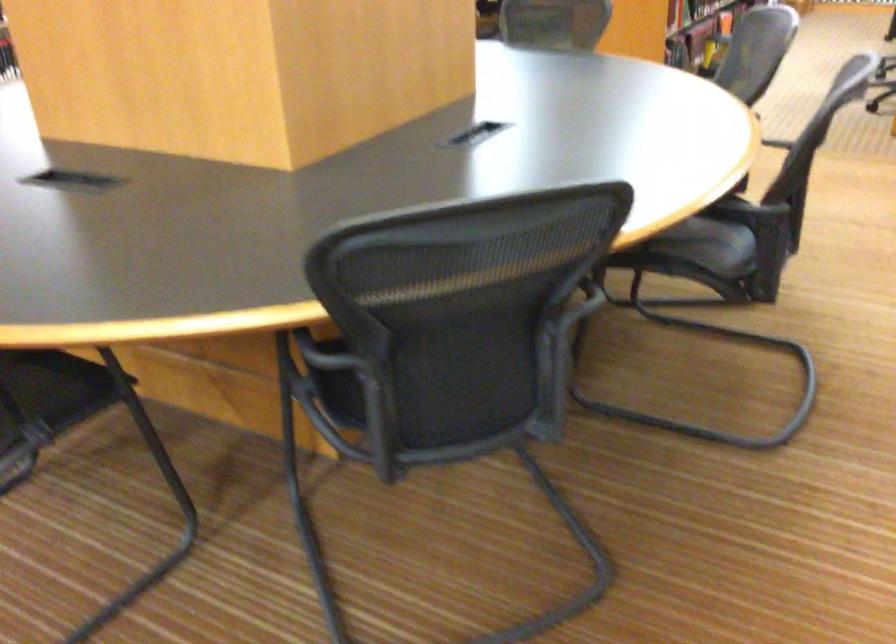
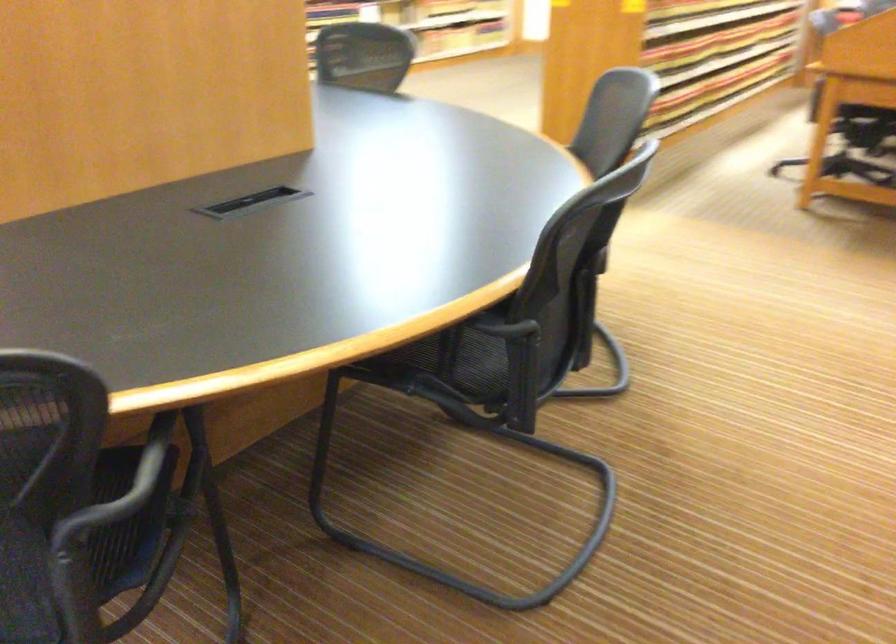
In a continuous first-person perspective shot, in which direction is the camera moving?

The cameraman moved toward right, forward.